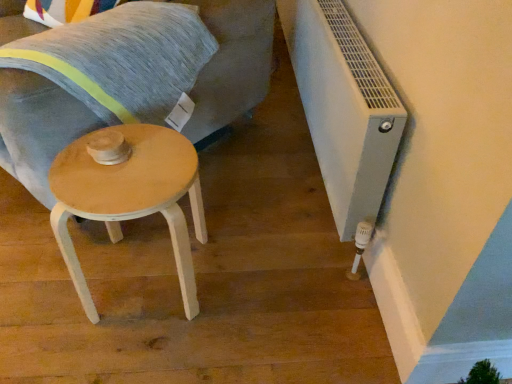
Question: Is light wood swivel chair at center facing towards light wood/wooden stool at lower left?

Choices:
 (A) no
 (B) yes

Answer: (A)

Question: Considering the relative sizes of light wood swivel chair at center and light wood/wooden stool at lower left in the image provided, is light wood swivel chair at center smaller than light wood/wooden stool at lower left?

Choices:
 (A) no
 (B) yes

Answer: (A)

Question: Is light wood swivel chair at center to the right of light wood/wooden stool at lower left from the viewer's perspective?

Choices:
 (A) no
 (B) yes

Answer: (A)

Question: From the image's perspective, is light wood swivel chair at center below light wood/wooden stool at lower left?

Choices:
 (A) yes
 (B) no

Answer: (B)

Question: Can you confirm if light wood swivel chair at center is bigger than light wood/wooden stool at lower left?

Choices:
 (A) yes
 (B) no

Answer: (A)

Question: From the image's perspective, is light wood swivel chair at center on top of light wood/wooden stool at lower left?

Choices:
 (A) no
 (B) yes

Answer: (B)

Question: Considering the relative positions of light wood/wooden stool at lower left and white plastic radiator at lower right in the image provided, is light wood/wooden stool at lower left to the right of white plastic radiator at lower right from the viewer's perspective?

Choices:
 (A) yes
 (B) no

Answer: (B)

Question: Is the position of light wood/wooden stool at lower left more distant than that of white plastic radiator at lower right?

Choices:
 (A) yes
 (B) no

Answer: (B)

Question: Can you see light wood/wooden stool at lower left touching white plastic radiator at lower right?

Choices:
 (A) yes
 (B) no

Answer: (B)

Question: Could you tell me if light wood/wooden stool at lower left is facing white plastic radiator at lower right?

Choices:
 (A) no
 (B) yes

Answer: (A)

Question: Considering the relative sizes of light wood/wooden stool at lower left and white plastic radiator at lower right in the image provided, is light wood/wooden stool at lower left wider than white plastic radiator at lower right?

Choices:
 (A) yes
 (B) no

Answer: (A)

Question: From the image's perspective, would you say light wood/wooden stool at lower left is shown under white plastic radiator at lower right?

Choices:
 (A) no
 (B) yes

Answer: (B)

Question: Considering the relative sizes of light wood swivel chair at center and textured gray pillow at upper left in the image provided, is light wood swivel chair at center bigger than textured gray pillow at upper left?

Choices:
 (A) yes
 (B) no

Answer: (A)